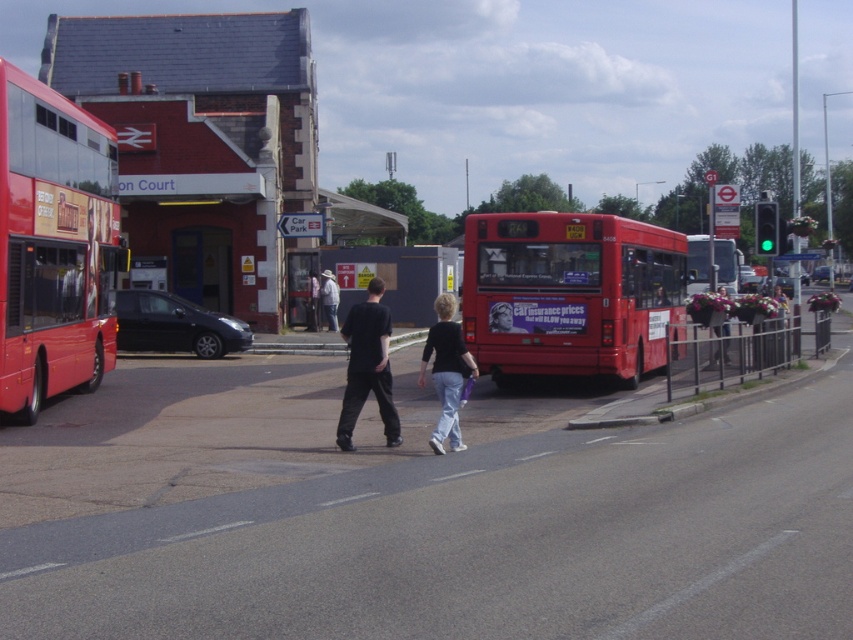
Who is taller, black cotton pants at center or light gray fabric jacket at center?

Standing taller between the two is black cotton pants at center.

Identify the location of black cotton pants at center. (367, 365).

Based on the photo, can you confirm if shiny red bus at left is positioned to the left of matte red bus at center?

Correct, you'll find shiny red bus at left to the left of matte red bus at center.

What do you see at coordinates (54, 244) in the screenshot? The image size is (853, 640). I see `shiny red bus at left` at bounding box center [54, 244].

The height and width of the screenshot is (640, 853). Identify the location of shiny red bus at left. (54, 244).

Can you confirm if matte red bus at center is taller than light gray fabric jacket at center?

Yes.

Is point (521, 256) more distant than point (318, 291)?

No, it is not.

Does point (674, 289) come behind point (321, 280)?

That is False.

Locate an element on the screen. matte red bus at center is located at coordinates (572, 292).